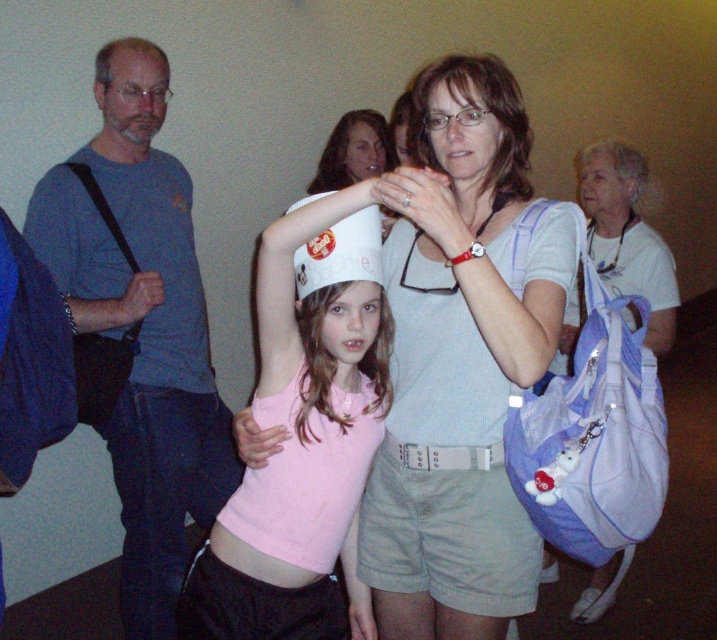
Which is behind, point (500, 193) or point (645, 164)?

Point (645, 164)

Between point (475, 99) and point (635, 148), which one is positioned behind?

The point (635, 148) is behind.

The width and height of the screenshot is (717, 640). I want to click on matte white hat at center, so click(475, 108).

Who is shorter, pink matte tank top at center or matte white hat at center?

Standing shorter between the two is matte white hat at center.

Who is more distant from viewer, [275,456] or [518,115]?

Positioned behind is point [518,115].

Which is behind, point (237, 598) or point (475, 77)?

Positioned behind is point (237, 598).

Where is `pink matte tank top at center`? This screenshot has width=717, height=640. pink matte tank top at center is located at coordinates (303, 436).

Which is above, blue cotton shirt at left or pink matte tank top at center?

blue cotton shirt at left is higher up.

What are the coordinates of `blue cotton shirt at left` in the screenshot? It's located at (142, 326).